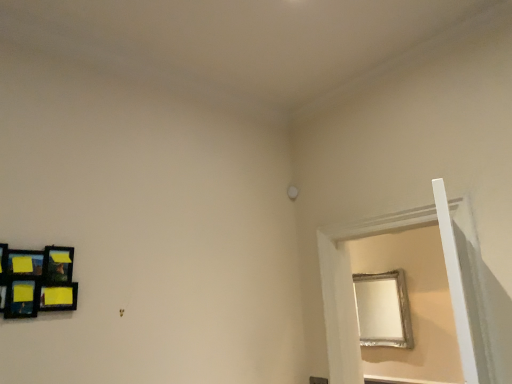
Question: From the image's perspective, is silver metallic frame at right above or below wooden-framed collage at left?

Choices:
 (A) above
 (B) below

Answer: (B)

Question: Which is correct: silver metallic frame at right is inside wooden-framed collage at left, or outside of it?

Choices:
 (A) inside
 (B) outside

Answer: (B)

Question: From their relative heights in the image, would you say silver metallic frame at right is taller or shorter than wooden-framed collage at left?

Choices:
 (A) short
 (B) tall

Answer: (B)

Question: Which is correct: wooden-framed collage at left is inside silver metallic frame at right, or outside of it?

Choices:
 (A) outside
 (B) inside

Answer: (A)

Question: Considering their positions, is wooden-framed collage at left located in front of or behind silver metallic frame at right?

Choices:
 (A) front
 (B) behind

Answer: (A)

Question: Considering the positions of wooden-framed collage at left and silver metallic frame at right in the image, is wooden-framed collage at left wider or thinner than silver metallic frame at right?

Choices:
 (A) wide
 (B) thin

Answer: (B)

Question: Based on their sizes in the image, would you say wooden-framed collage at left is bigger or smaller than silver metallic frame at right?

Choices:
 (A) small
 (B) big

Answer: (A)